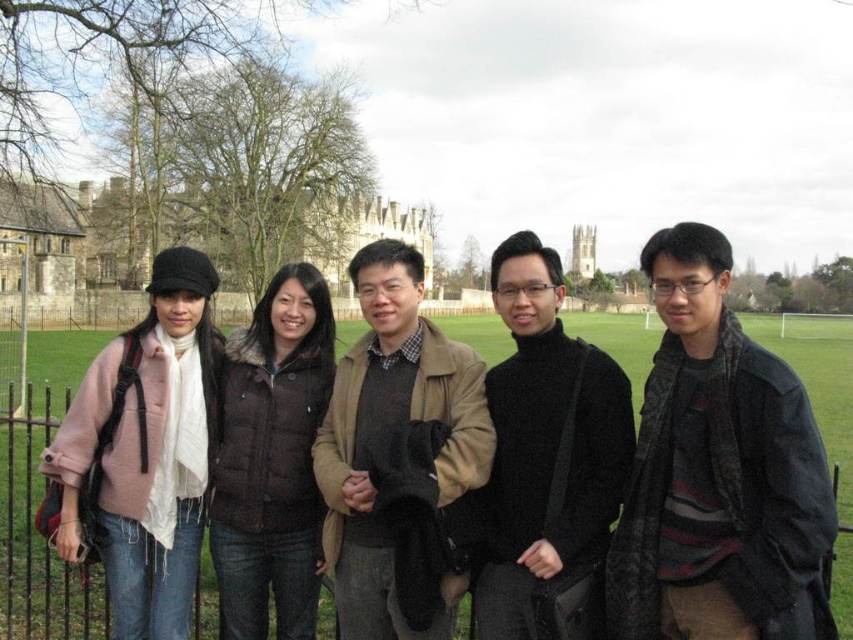
Question: Which point appears closest to the camera in this image?

Choices:
 (A) click(413, 328)
 (B) click(724, 625)
 (C) click(503, 618)

Answer: (B)

Question: Which point is farther from the camera taking this photo?

Choices:
 (A) (456, 596)
 (B) (569, 470)

Answer: (B)

Question: Does matte brown coat at center have a greater width compared to green grass football field at center?

Choices:
 (A) yes
 (B) no

Answer: (B)

Question: Is dark gray wool scarf at right above black wool sweater at center?

Choices:
 (A) no
 (B) yes

Answer: (A)

Question: Considering the real-world distances, which object is closest to the green grass football field at center?

Choices:
 (A) matte brown coat at center
 (B) dark gray wool scarf at right
 (C) black wool sweater at center

Answer: (B)

Question: Does matte brown coat at center have a lesser width compared to green grass football field at center?

Choices:
 (A) yes
 (B) no

Answer: (A)